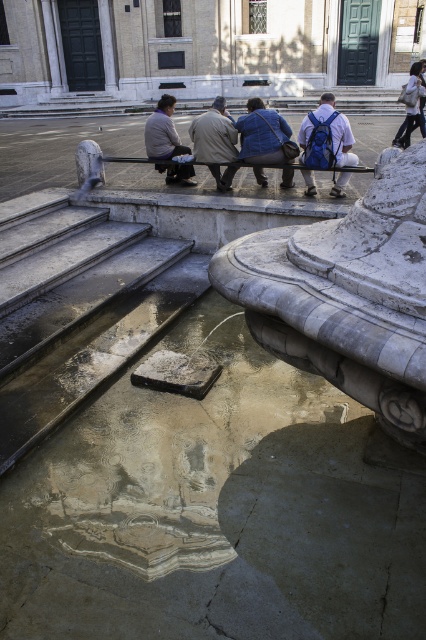
Question: Is denim jacket at center thinner than khaki cotton pants at center?

Choices:
 (A) no
 (B) yes

Answer: (A)

Question: Is denim jacket at center in front of light brown leather jacket at upper left?

Choices:
 (A) no
 (B) yes

Answer: (B)

Question: Among these objects, which one is farthest from the camera?

Choices:
 (A) denim jacket at center
 (B) light brown leather jacket at upper left

Answer: (B)

Question: Is white marble fountain at center bigger than khaki cotton pants at center?

Choices:
 (A) yes
 (B) no

Answer: (A)

Question: Which of the following is the closest to the observer?

Choices:
 (A) (x=371, y=310)
 (B) (x=267, y=129)

Answer: (A)

Question: Which of these objects is positioned closest to the white marble fountain at center?

Choices:
 (A) light brown leather jacket at upper left
 (B) matte blue backpack at center
 (C) white fabric bag at upper right
 (D) denim jacket at center

Answer: (D)